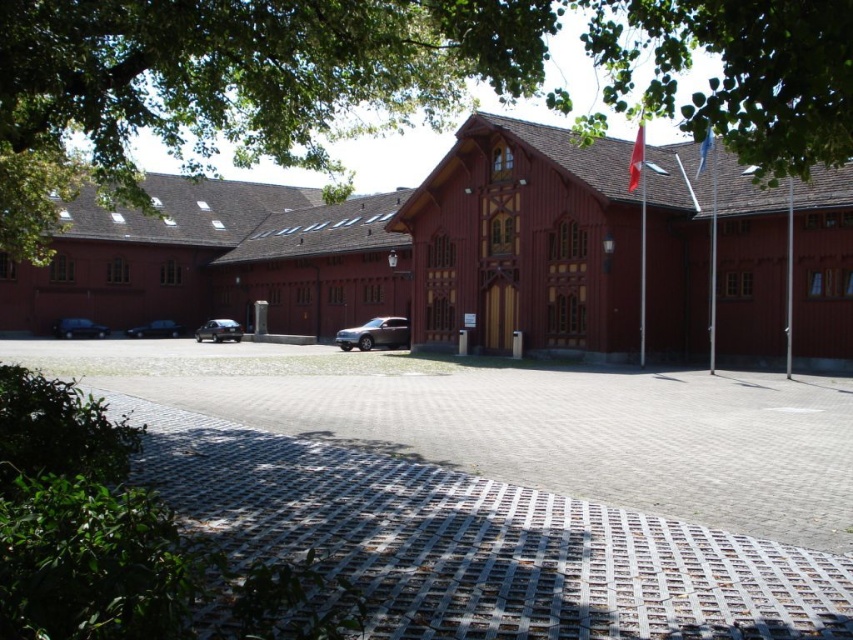
Measure the distance between green leafy tree at upper center and satin silver suv at center.

They are 135.48 feet apart.

Does green leafy tree at upper center have a lesser height compared to satin silver suv at center?

In fact, green leafy tree at upper center may be taller than satin silver suv at center.

Is point (392, 70) positioned behind point (397, 323)?

No.

The image size is (853, 640). I want to click on green leafy tree at upper center, so pos(404,72).

Who is positioned more to the right, green leafy tree at upper center or shiny black car at left?

green leafy tree at upper center is more to the right.

Is point (358, 12) positioned behind point (172, 326)?

No, (358, 12) is in front of (172, 326).

Between point (323, 154) and point (138, 330), which one is positioned in front?

Point (323, 154)

Locate an element on the screen. The width and height of the screenshot is (853, 640). green leafy tree at upper center is located at coordinates (404, 72).

Between point (724, 508) and point (401, 336), which one is positioned in front?

Point (724, 508) is more forward.

In the scene shown: Is the position of gray concrete driveway at center more distant than that of satin silver suv at center?

No, it is in front of satin silver suv at center.

At what (x,y) coordinates should I click in order to perform the action: click on gray concrete driveway at center. Please return your answer as a coordinate pair (x, y). Image resolution: width=853 pixels, height=640 pixels. Looking at the image, I should click on (525, 422).